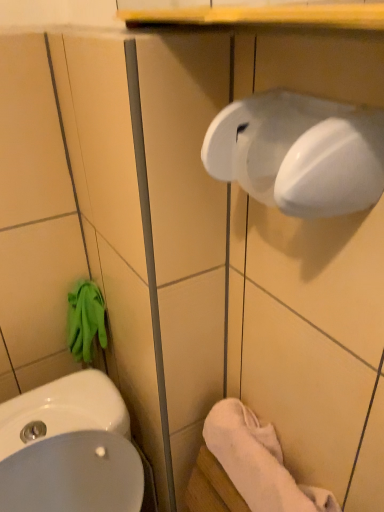
Question: Relative to white soft towel at lower right, is white glossy sink at lower left in front or behind?

Choices:
 (A) behind
 (B) front

Answer: (B)

Question: Do you think white glossy sink at lower left is within white soft towel at lower right, or outside of it?

Choices:
 (A) inside
 (B) outside

Answer: (B)

Question: Estimate the real-world distances between objects in this image. Which object is farther from the white glossy hand dryer at upper right?

Choices:
 (A) white glossy sink at lower left
 (B) white soft towel at lower right

Answer: (A)

Question: Estimate the real-world distances between objects in this image. Which object is closer to the white glossy hand dryer at upper right?

Choices:
 (A) white soft towel at lower right
 (B) white glossy sink at lower left

Answer: (A)